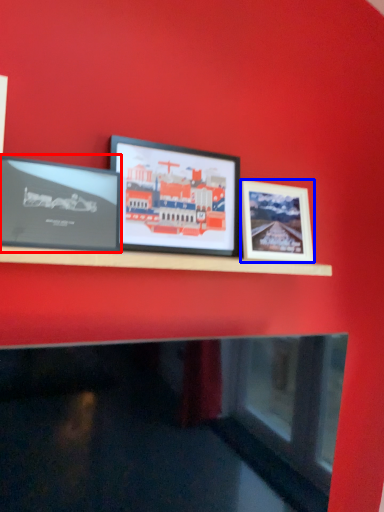
Question: Among these objects, which one is nearest to the camera, picture frame (highlighted by a red box) or picture frame (highlighted by a blue box)?

Choices:
 (A) picture frame
 (B) picture frame

Answer: (A)